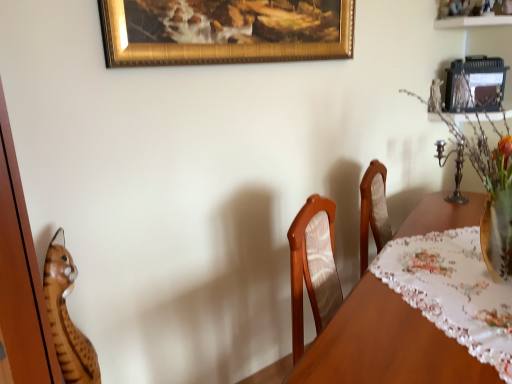
Question: In terms of width, does gold textured frame at upper center look wider or thinner when compared to translucent glass vase with colorful flowers at right?

Choices:
 (A) wide
 (B) thin

Answer: (B)

Question: From a real-world perspective, relative to translucent glass vase with colorful flowers at right, is gold textured frame at upper center vertically above or below?

Choices:
 (A) above
 (B) below

Answer: (A)

Question: Estimate the real-world distances between objects in this image. Which object is closer to the wooden tiger at left?

Choices:
 (A) translucent glass vase with colorful flowers at right
 (B) gold textured frame at upper center
 (C) wooden table at center

Answer: (C)

Question: Which object is the closest to the gold textured frame at upper center?

Choices:
 (A) wooden table at center
 (B) translucent glass vase with colorful flowers at right
 (C) wooden tiger at left

Answer: (B)